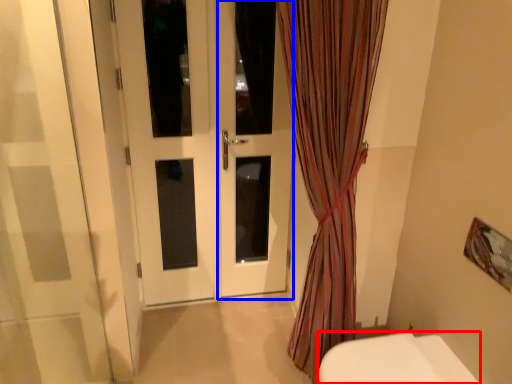
Question: Which of the following is the closest to the observer, toilet (highlighted by a red box) or screen door (highlighted by a blue box)?

Choices:
 (A) toilet
 (B) screen door

Answer: (A)